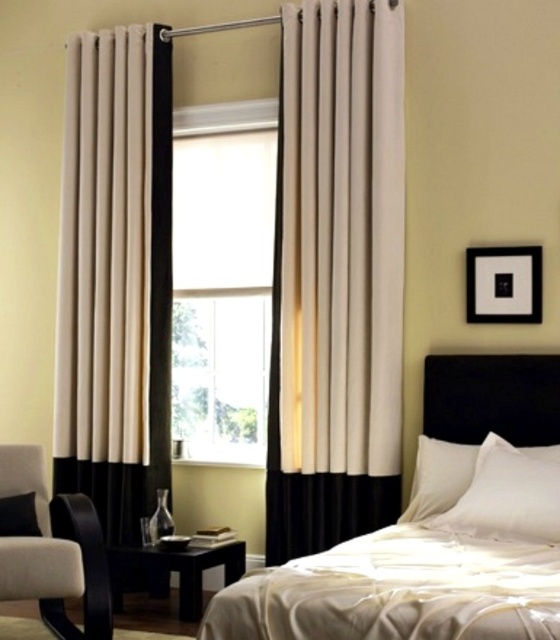
You are planning to rearrange the furniture in the bedroom. If you want to place the beige fabric armchair at left closer to the window, will it fit between the white satin bed at center and the window? Please consider the size difference between the two objects.

The white satin bed at center is larger in size than the beige fabric armchair at left. Since the armchair is smaller, it should fit between the bed and the window if there is enough space. However, the exact fit depends on the available space between the bed and the window, which isn not specified in the description.

You are designing a layout for a bedroom and want to ensure that the white satin bed at center and the black matte picture frame at upper right are proportionally balanced. Given their sizes, which object should be placed closer to the window to maintain visual harmony?

The white satin bed at center is bigger than the black matte picture frame at upper right, so to maintain visual harmony, the larger white satin bed at center should be placed closer to the window where it can anchor the space, while the smaller black matte picture frame at upper right can be positioned further back to balance the composition.

You are an interior designer evaluating the bedroom layout. The client wants to ensure that the white satin bed at center and the black matte picture frame at upper right are positioned for optimal visual balance. Considering their sizes, which object should be placed lower to maintain balance?

The black matte picture frame at upper right should be placed lower since the white satin bed at center is much taller, so lowering the smaller object helps balance the composition.